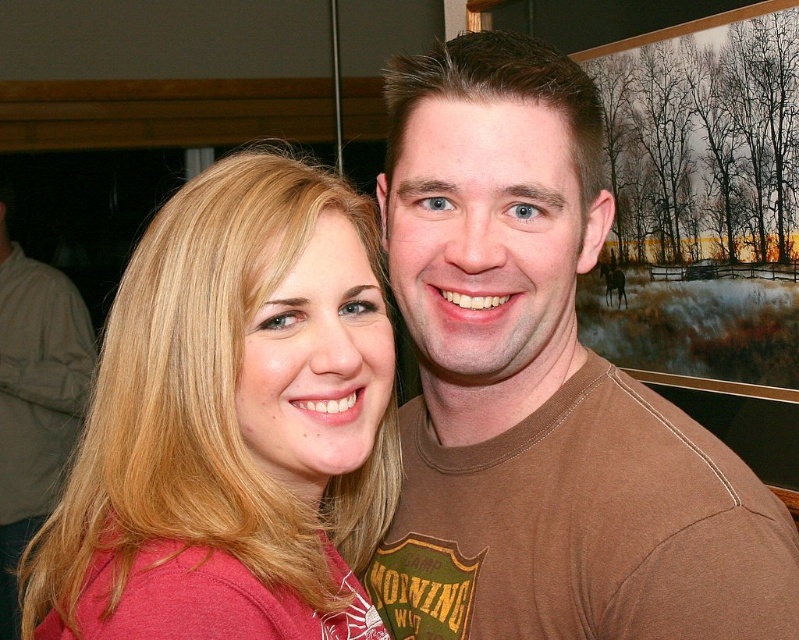
Question: Which point is farther to the camera?

Choices:
 (A) blonde hair at left
 (B) matte red shirt at left

Answer: (A)

Question: Does matte red shirt at left appear under blonde hair at left?

Choices:
 (A) no
 (B) yes

Answer: (A)

Question: Does matte red shirt at left appear on the right side of blonde hair at left?

Choices:
 (A) no
 (B) yes

Answer: (B)

Question: Does matte red shirt at left lie in front of blonde hair at left?

Choices:
 (A) yes
 (B) no

Answer: (A)

Question: Among these objects, which one is farthest from the camera?

Choices:
 (A) matte red shirt at left
 (B) blonde hair at left

Answer: (B)

Question: Which of the following is the farthest from the observer?

Choices:
 (A) (358, 276)
 (B) (22, 458)

Answer: (B)